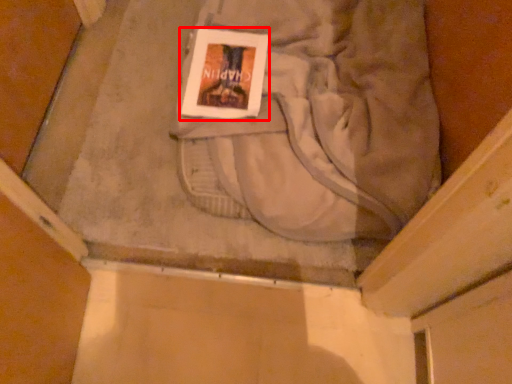
Question: From the image's perspective, where is paperback book (annotated by the red box) located relative to sweat pant?

Choices:
 (A) below
 (B) above

Answer: (A)